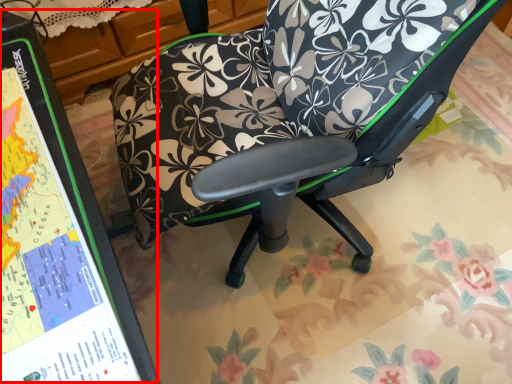
Question: Where is bulletin board (annotated by the red box) located in relation to chair in the image?

Choices:
 (A) left
 (B) right

Answer: (A)